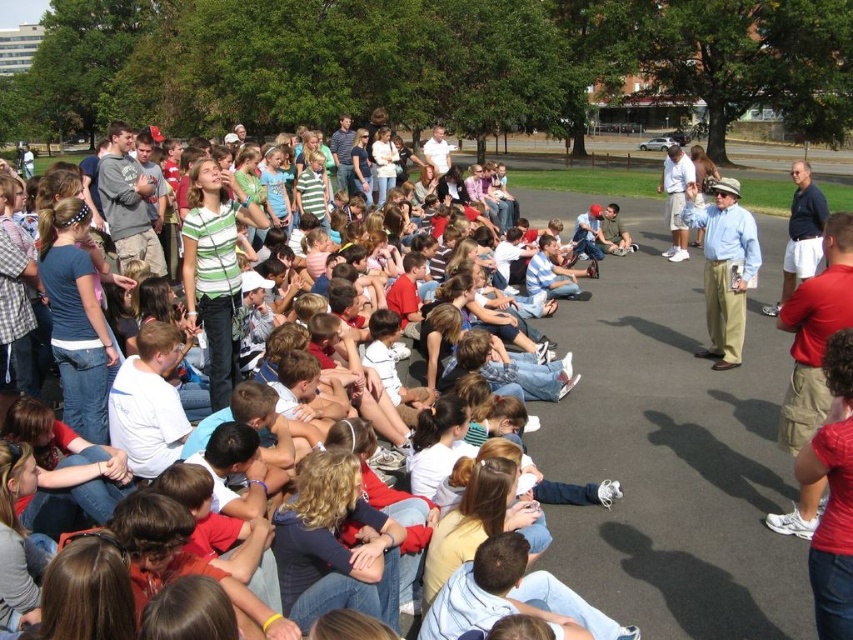
You are a photographer trying to capture a group photo of the striped shirt at center and the light blue shirt at center. Since you want both subjects to be in the frame, which direction should you move your camera to include both?

Since the striped shirt at center is to the left of the light blue shirt at center, you should move your camera to the left to include both subjects in the frame.